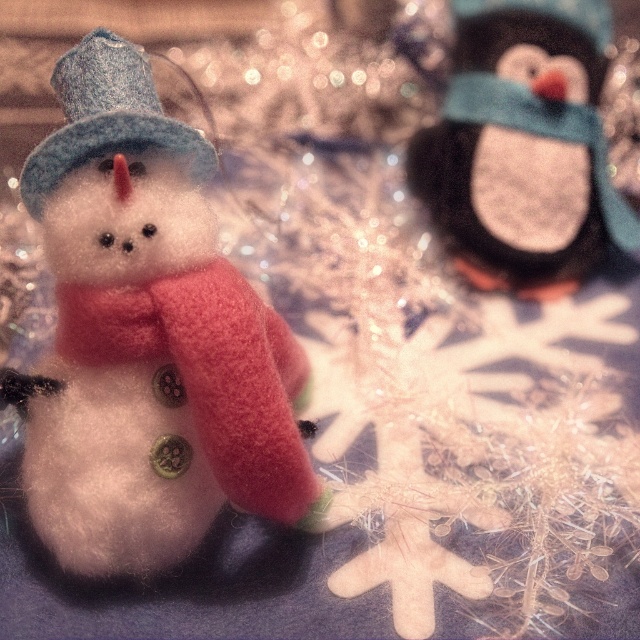
You are organizing a winter display and need to place the felt snowman at left and the felt blue hat at left in a specific arrangement. According to the image, which object is positioned more to the left?

The felt blue hat at left is positioned more to the left than the felt snowman at left.

You are an observer looking at the festive scene. There are two handmade ornaments in the image. One is the felt snowman at left and the other is a point at coordinate (x=147, y=339). Which ornament is located on the left side of the image?

The felt snowman at left is located on the left side of the image, while the point at coordinate (x=147, y=339) is actually the same as the felt snowman at left, so both are at the left side.